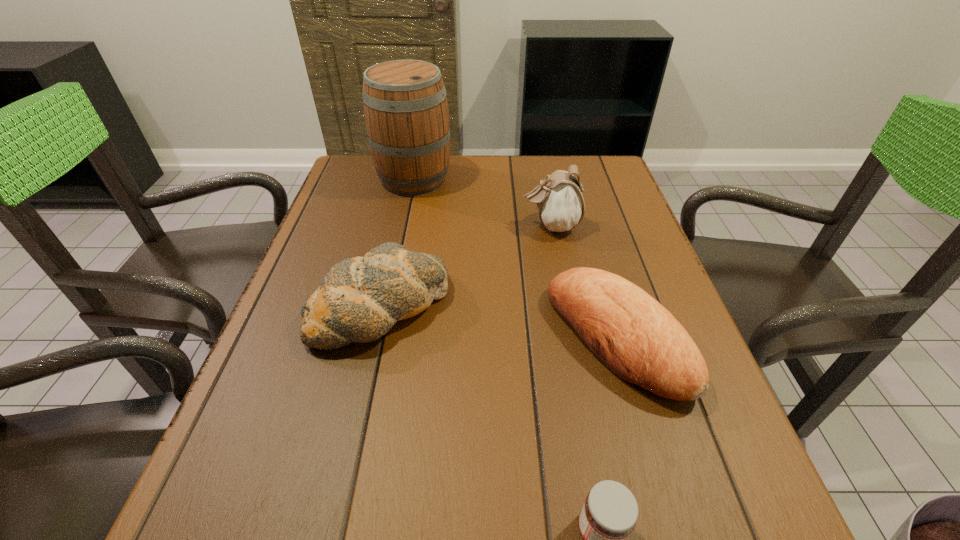
Identify the location of the tallest object. (406, 112).

At what (x,y) coordinates should I click in order to perform the action: click on the farthest object. Please return your answer as a coordinate pair (x, y). Image resolution: width=960 pixels, height=540 pixels. Looking at the image, I should click on (406, 112).

Locate an element on the screen. the second tallest object is located at coordinates (559, 199).

Where is `the fourth nearest object`? This screenshot has height=540, width=960. the fourth nearest object is located at coordinates (559, 199).

Locate an element on the screen. This screenshot has height=540, width=960. the left bread is located at coordinates (360, 299).

At what (x,y) coordinates should I click in order to perform the action: click on the taller bread. Please return your answer as a coordinate pair (x, y). Looking at the image, I should click on (360, 299).

Identify the location of the right bread. This screenshot has width=960, height=540. (635, 337).

You are a GUI agent. You are given a task and a screenshot of the screen. Output one action in this format:
    pyautogui.click(x=<x>, y=<y>)
    Task: Click on the vacant space located on the front of the tallest object
    The width and height of the screenshot is (960, 540).
    Given the screenshot: What is the action you would take?
    pyautogui.click(x=406, y=218)

You are a GUI agent. You are given a task and a screenshot of the screen. Output one action in this format:
    pyautogui.click(x=<x>, y=<y>)
    Task: Click on the blank area located on the front-facing side of the second tallest object
    
    Given the screenshot: What is the action you would take?
    pyautogui.click(x=446, y=226)

Where is `free space located 0.300m on the front-facing side of the second tallest object`? This screenshot has width=960, height=540. free space located 0.300m on the front-facing side of the second tallest object is located at coordinates (409, 226).